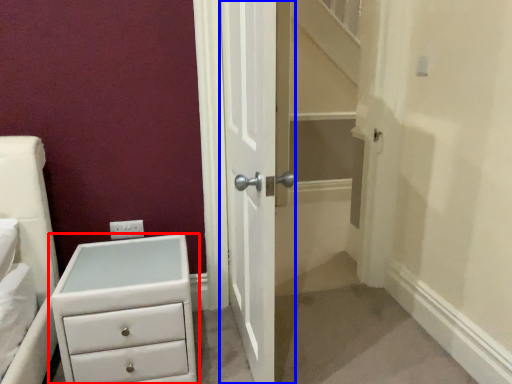
Question: Which point is closer to the camera, chest of drawers (highlighted by a red box) or door (highlighted by a blue box)?

Choices:
 (A) chest of drawers
 (B) door

Answer: (B)